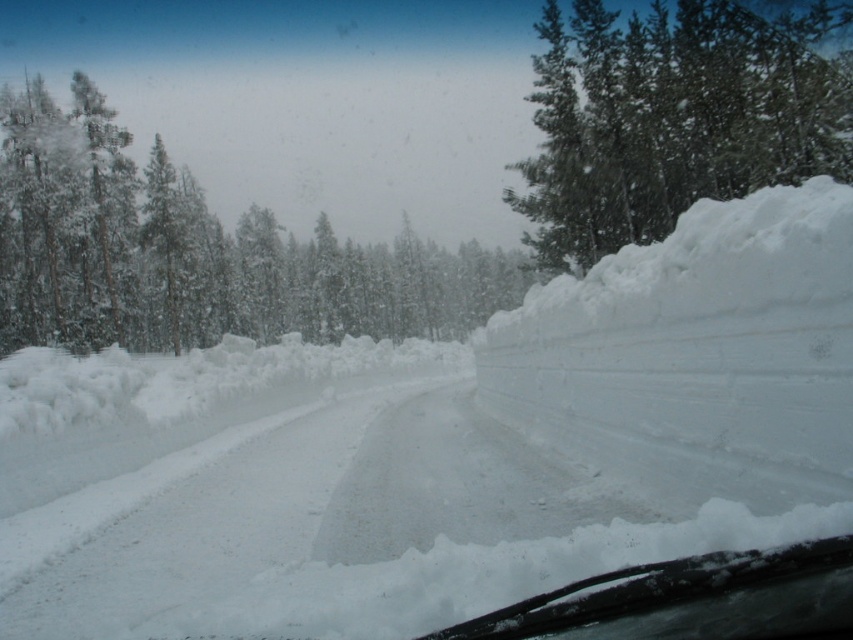
Question: Can you confirm if white frosty trees at upper center is smaller than green textured snow at upper right?

Choices:
 (A) no
 (B) yes

Answer: (B)

Question: Which object is the closest to the white fluffy snow at center?

Choices:
 (A) white frosty trees at upper center
 (B) clear glass windshield at lower center
 (C) green textured snow at upper right

Answer: (B)

Question: Which point is closer to the camera?

Choices:
 (A) (720, 51)
 (B) (527, 278)
 (C) (647, 419)

Answer: (C)

Question: Is white fluffy snow at center to the left of clear glass windshield at lower center from the viewer's perspective?

Choices:
 (A) no
 (B) yes

Answer: (B)

Question: Which of these objects is positioned closest to the white fluffy snow at center?

Choices:
 (A) white frosty trees at upper center
 (B) clear glass windshield at lower center
 (C) green textured snow at upper right

Answer: (B)

Question: Does white fluffy snow at center come in front of white frosty trees at upper center?

Choices:
 (A) no
 (B) yes

Answer: (B)